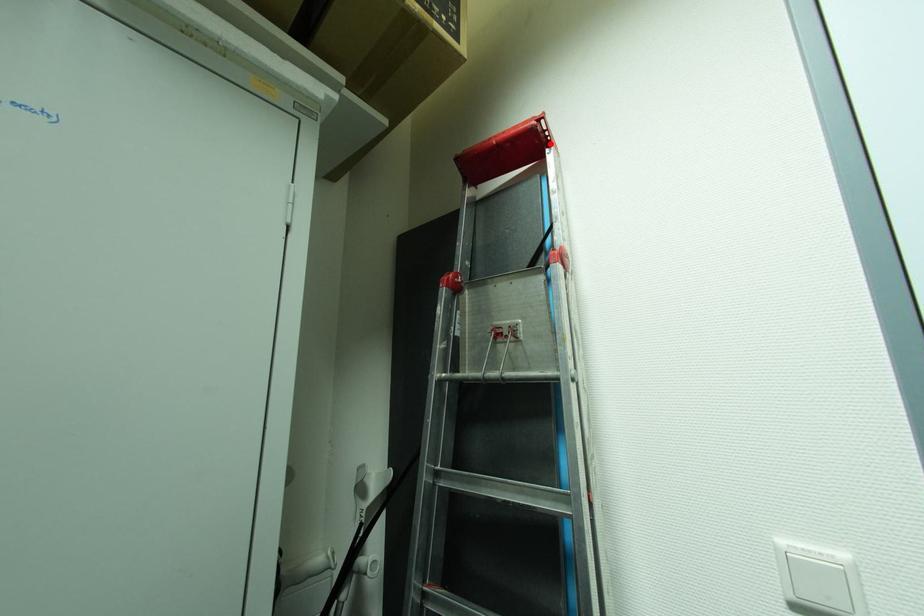
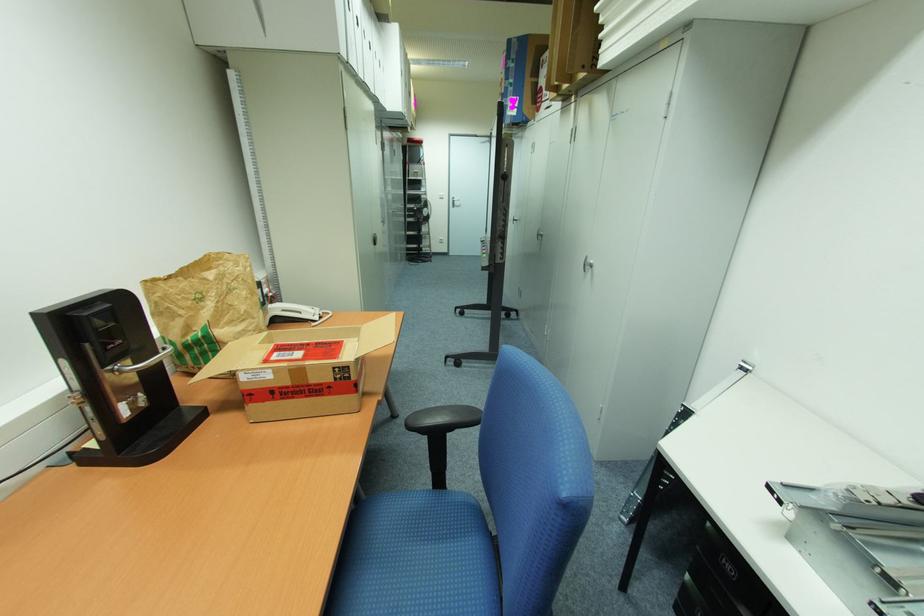
Question: I am providing you with two images of the same scene from different viewpoints. A red point is marked on the first image. At the location where the point appears in image 1, is it still visible in image 2?

Choices:
 (A) Yes
 (B) No

Answer: (A)